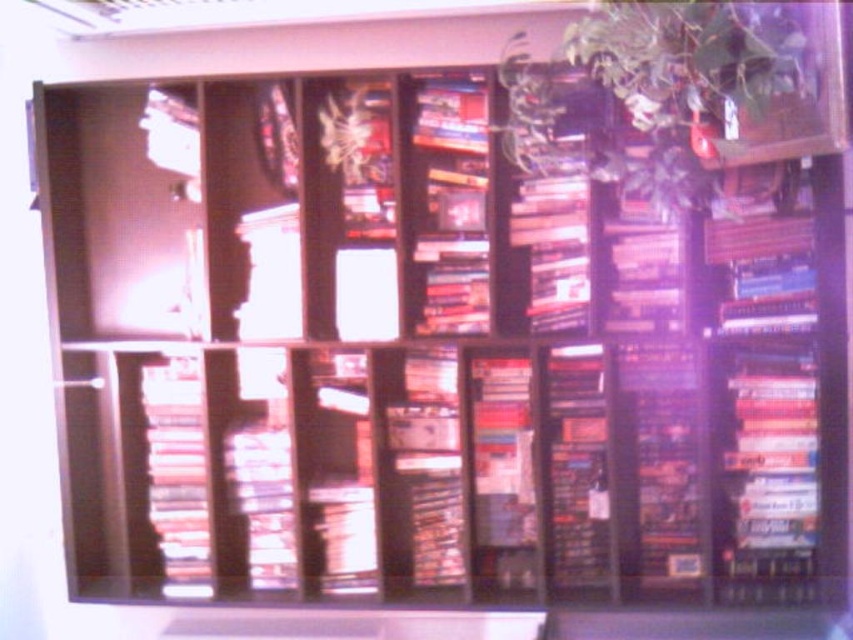
You are standing in front of the bookshelf and want to reach the point at coordinates point (663,4). If your arm can extend 4 feet, can you reach it?

The point (663,4) is 4.87 feet away from you. Since your arm can only extend 4 feet, you cannot reach it.

You are standing in front of a bookshelf with a hardcover book at right. If you want to reach this book, will you need to stretch your arms fully or can you reach it comfortably?

The hardcover book at right is 6.59 feet from camera, so you will need to stretch your arms fully to reach it.

Consider the image. You are organizing books on a shelf and have to place the green leafy plant at upper right and the matte plastic books at left. Given their widths, which object should you place first to ensure they fit properly?

The green leafy plant at upper right is wider than the matte plastic books at left, so you should place the green leafy plant at upper right first to ensure there is enough space for both items on the shelf.